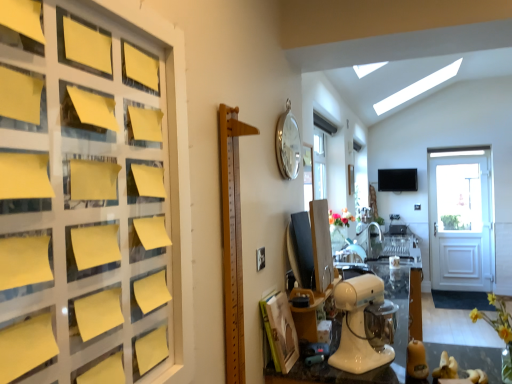
Question: Is yellow matte flower at lower right, the second flower in the top-to-bottom sequence, oriented away from yellow paper at left?

Choices:
 (A) yes
 (B) no

Answer: (B)

Question: From a real-world perspective, is yellow matte flower at lower right, marked as the first flower in a bottom-to-top arrangement, on yellow paper at left?

Choices:
 (A) yes
 (B) no

Answer: (B)

Question: Does yellow matte flower at lower right, marked as the first flower in a bottom-to-top arrangement, appear on the right side of yellow paper at left?

Choices:
 (A) no
 (B) yes

Answer: (B)

Question: From the image's perspective, does yellow matte flower at lower right, which appears as the 2th flower when viewed from the back, appear lower than yellow paper at left?

Choices:
 (A) yes
 (B) no

Answer: (A)

Question: Is yellow matte flower at lower right, the first flower viewed from the front, positioned in front of yellow paper at left?

Choices:
 (A) yes
 (B) no

Answer: (B)

Question: Is yellow matte flower at lower right, the first flower viewed from the front, outside yellow paper at left?

Choices:
 (A) yes
 (B) no

Answer: (A)

Question: Does yellow matte flower at lower right, the second flower in the top-to-bottom sequence, have a greater width compared to silver metallic clock at upper center?

Choices:
 (A) no
 (B) yes

Answer: (B)

Question: Is yellow matte flower at lower right, which appears as the 2th flower when viewed from the back, in front of silver metallic clock at upper center?

Choices:
 (A) no
 (B) yes

Answer: (B)

Question: Can you confirm if yellow matte flower at lower right, the first flower viewed from the front, is smaller than silver metallic clock at upper center?

Choices:
 (A) no
 (B) yes

Answer: (A)

Question: Can you confirm if yellow matte flower at lower right, the second flower in the top-to-bottom sequence, is positioned to the left of silver metallic clock at upper center?

Choices:
 (A) yes
 (B) no

Answer: (B)

Question: From the image's perspective, is yellow matte flower at lower right, the first flower viewed from the front, below silver metallic clock at upper center?

Choices:
 (A) no
 (B) yes

Answer: (B)

Question: Are yellow matte flower at lower right, marked as the first flower in a bottom-to-top arrangement, and silver metallic clock at upper center located far from each other?

Choices:
 (A) no
 (B) yes

Answer: (B)

Question: Does yellow paper at left have a smaller size compared to floral bouquet at center, the 2th flower ordered from the bottom?

Choices:
 (A) no
 (B) yes

Answer: (A)